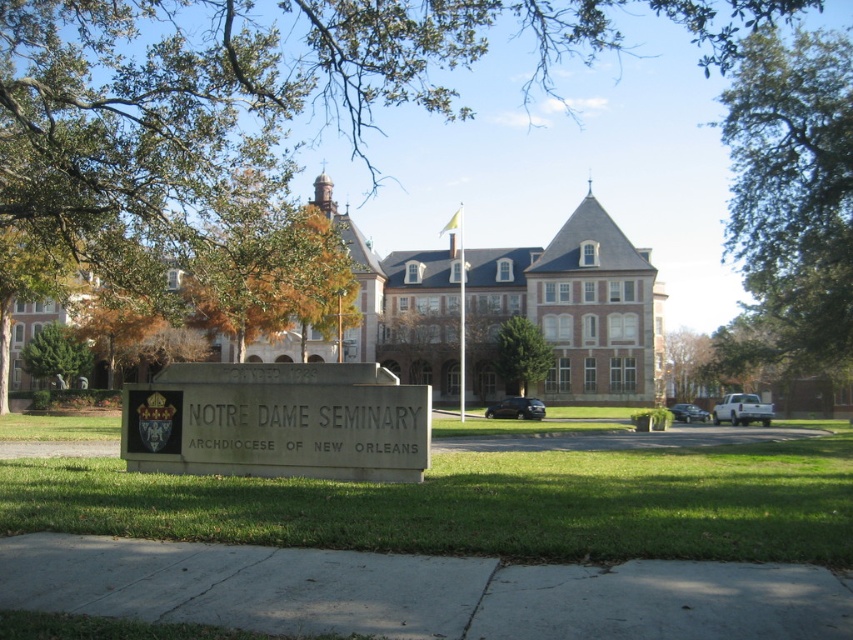
You are a landscape architect planning to install a new walkway between the green leafy tree at upper center and the green leafy tree at center. What is the minimum length of the walkway needed to connect them?

The minimum length of the walkway needed to connect the green leafy tree at upper center and the green leafy tree at center is 41.37 meters, as that is the distance between them.

You are a visitor approaching the entrance of Notre Dame Seminary. You notice the gray stone sign at center and the green leafy tree at upper left. Which object appears narrower from your perspective?

The gray stone sign at center appears narrower than the green leafy tree at upper left because it has a lesser width according to the description.